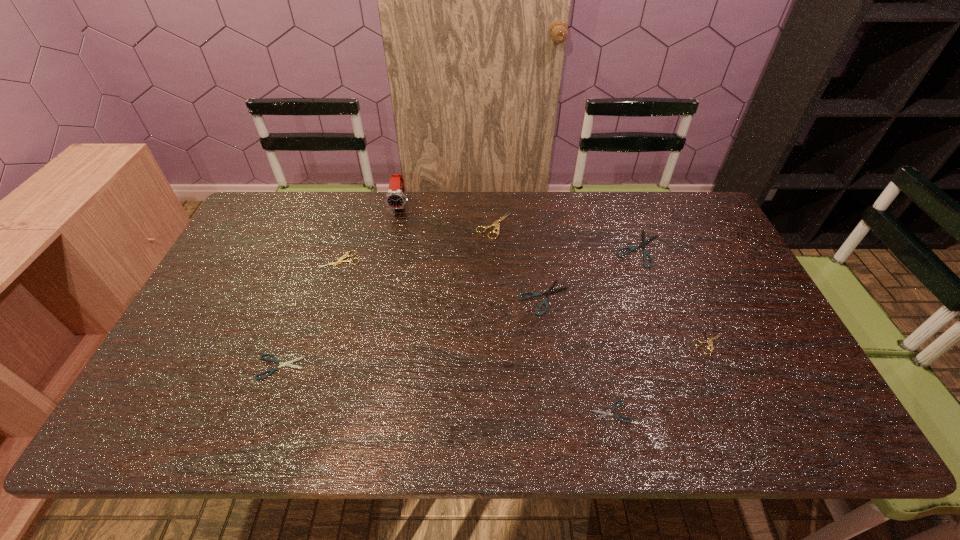
Image resolution: width=960 pixels, height=540 pixels. I want to click on vacant space that satisfies the following two spatial constraints: 1. on the face of the red watch; 2. on the left side of the nearest black shears, so click(x=358, y=411).

Where is `free space that satisfies the following two spatial constraints: 1. on the back side of the rightmost black shears; 2. on the right side of the leftmost beige shears`? free space that satisfies the following two spatial constraints: 1. on the back side of the rightmost black shears; 2. on the right side of the leftmost beige shears is located at coordinates (345, 248).

This screenshot has width=960, height=540. What are the coordinates of `vacant region that satisfies the following two spatial constraints: 1. on the face of the third object from left to right; 2. on the right side of the shortest object` in the screenshot? It's located at [358, 411].

Identify the location of vacant space that satisfies the following two spatial constraints: 1. on the front side of the fifth farthest object; 2. on the right side of the smallest black shears. The height and width of the screenshot is (540, 960). (560, 411).

You are a GUI agent. You are given a task and a screenshot of the screen. Output one action in this format:
    pyautogui.click(x=<x>, y=<y>)
    Task: Click on the free space that satisfies the following two spatial constraints: 1. on the face of the red watch; 2. on the right side of the rightmost black shears
    This screenshot has width=960, height=540.
    Given the screenshot: What is the action you would take?
    pyautogui.click(x=392, y=248)